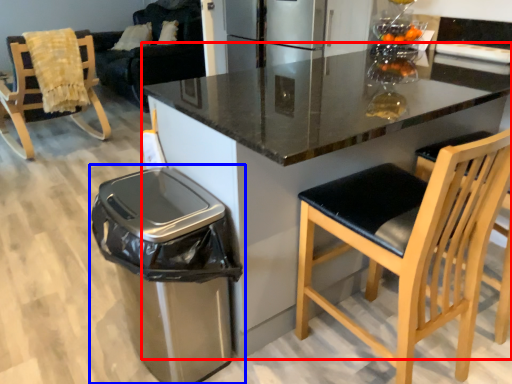
Question: Which object appears closest to the camera in this image, countertop (highlighted by a red box) or waste container (highlighted by a blue box)?

Choices:
 (A) countertop
 (B) waste container

Answer: (A)